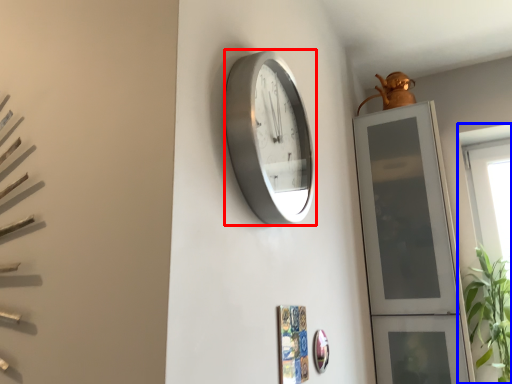
Question: Among these objects, which one is farthest to the camera, wall clock (highlighted by a red box) or window (highlighted by a blue box)?

Choices:
 (A) wall clock
 (B) window

Answer: (B)